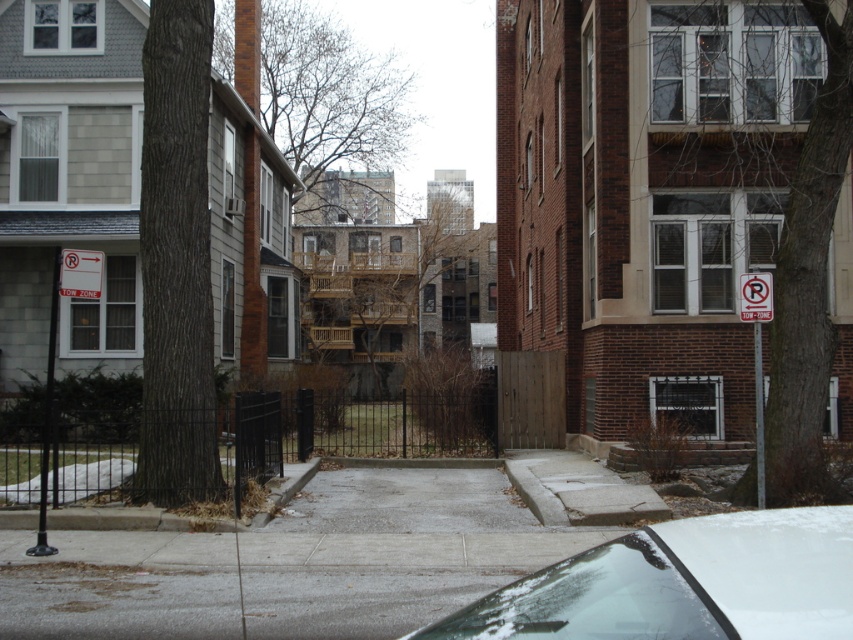
You are a delivery person trying to navigate between the brown bark tree at right and the white plastic sign at left. Which object is taller, and how might this affect your path?

The white plastic sign at left is taller than the brown bark tree at right. Since the sign is taller, it might be more visible and could help guide your path, while the shorter tree might not obstruct your view as much.

You are a delivery person trying to navigate between the brown rough bark tree at left and the brown wooden tree at center. Which tree should you walk around to reach the sidewalk behind them?

You should walk around the brown rough bark tree at left because it is positioned below the brown wooden tree at center, meaning it is closer to the ground and likely allows easier passage to the sidewalk behind them.

You are a delivery person trying to park your white glossy car at lower right between the brown rough bark tree at left and the fence. Can your car fit there without touching either?

The white glossy car at lower right is wider than the brown rough bark tree at left. Therefore, there might not be enough space for the car to fit between them without touching either side.